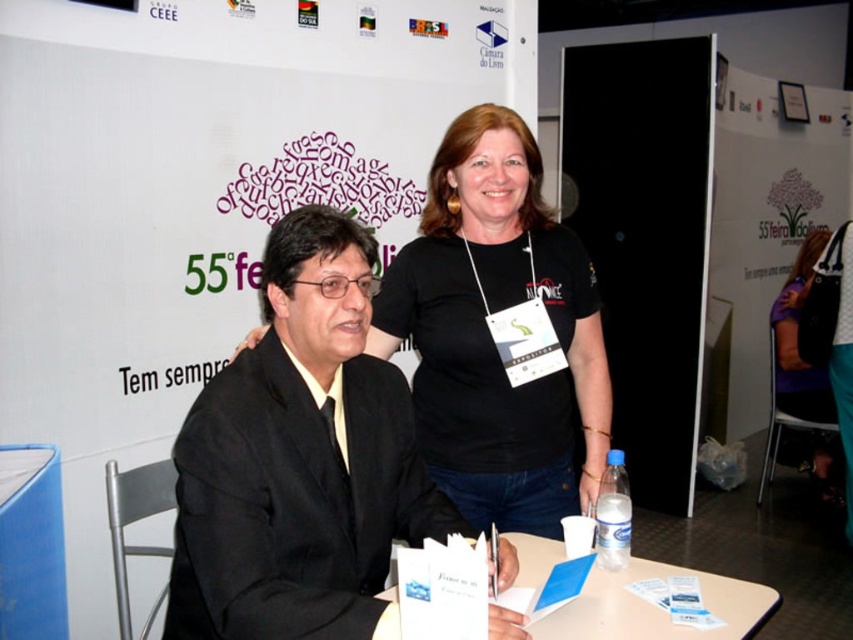
Question: Which point is farther to the camera?

Choices:
 (A) black cotton t-shirt at upper center
 (B) black cotton shirt at upper right
 (C) white plastic table at center

Answer: (B)

Question: Which of the following is the farthest from the observer?

Choices:
 (A) black cotton t-shirt at upper center
 (B) black suit at left

Answer: (A)

Question: In this image, where is black cotton t-shirt at upper center located relative to clear plastic bottle at table right?

Choices:
 (A) right
 (B) left

Answer: (B)

Question: Which point is closer to the camera?

Choices:
 (A) (795, 368)
 (B) (566, 627)
 (C) (595, 504)

Answer: (B)

Question: Does black cotton shirt at upper right appear over clear plastic bottle at table right?

Choices:
 (A) no
 (B) yes

Answer: (B)

Question: Does white plastic table at center have a larger size compared to clear plastic bottle at table right?

Choices:
 (A) yes
 (B) no

Answer: (A)